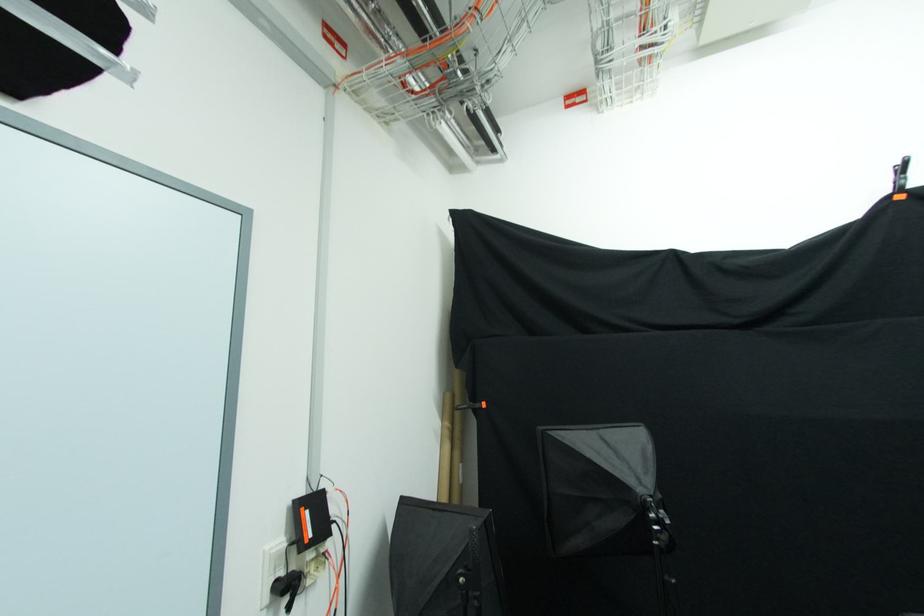
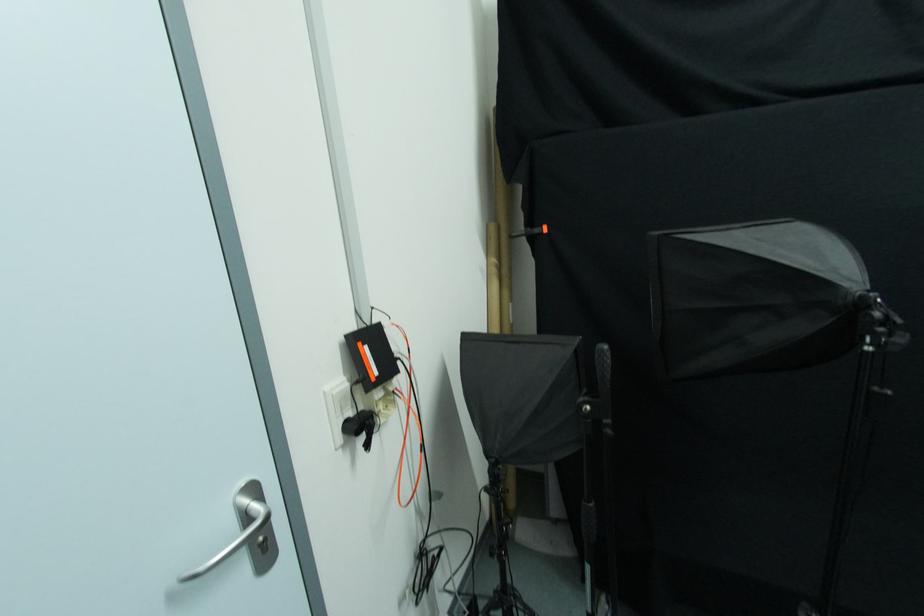
Question: The images are taken continuously from a first-person perspective. In which direction is your viewpoint rotating?

Choices:
 (A) Left
 (B) Right
 (C) Up
 (D) Down

Answer: (D)